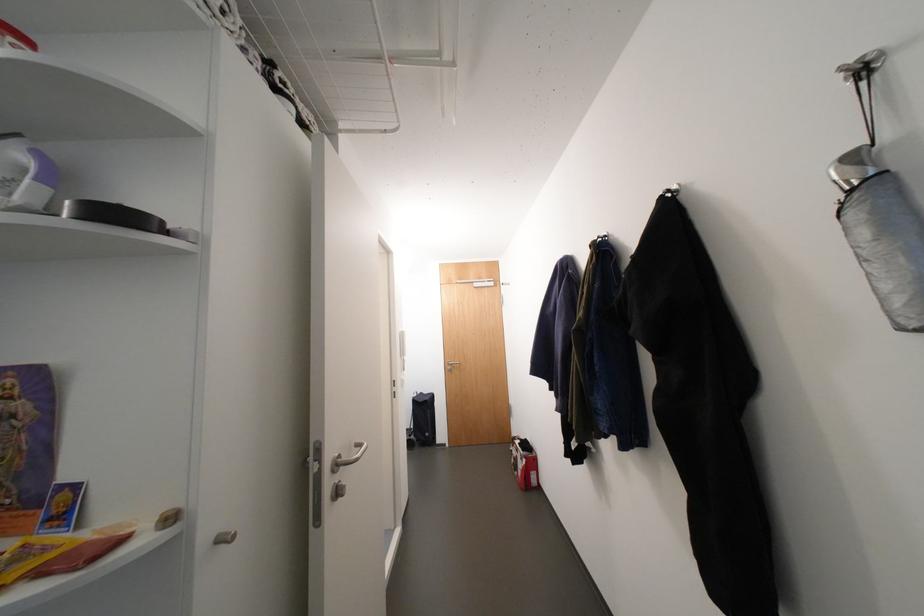
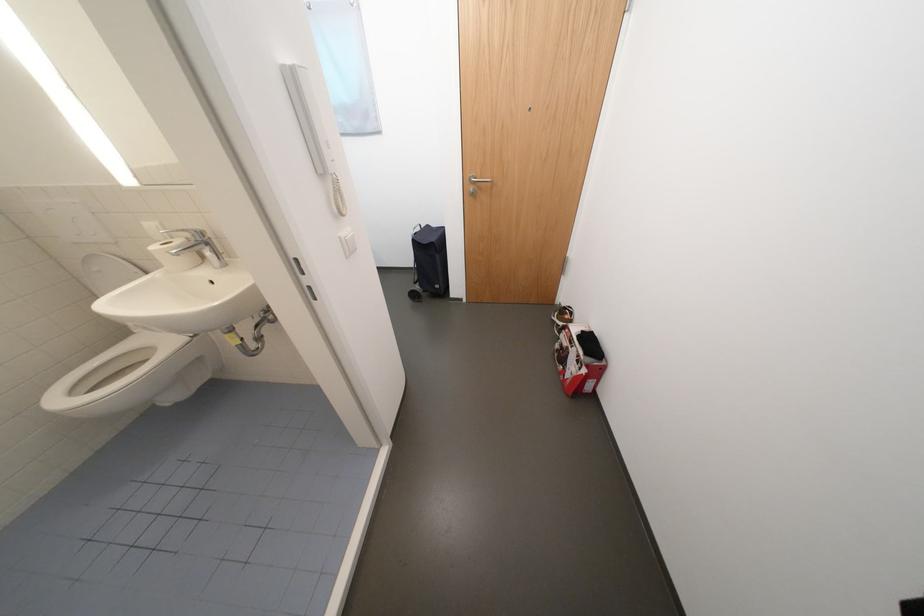
The point at (532, 462) is marked in the first image. Where is the corresponding point in the second image?

(592, 371)